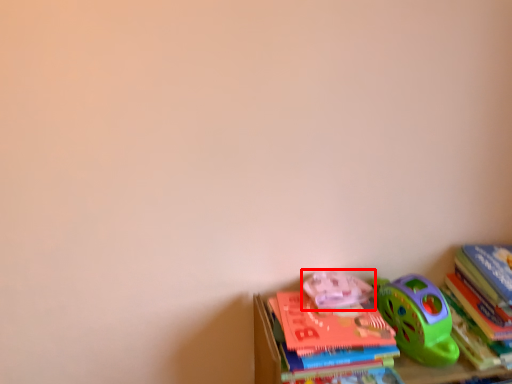
Question: From the image's perspective, considering the relative positions of toy (annotated by the red box) and book in the image provided, where is toy (annotated by the red box) located with respect to the staircase?

Choices:
 (A) below
 (B) above

Answer: (B)